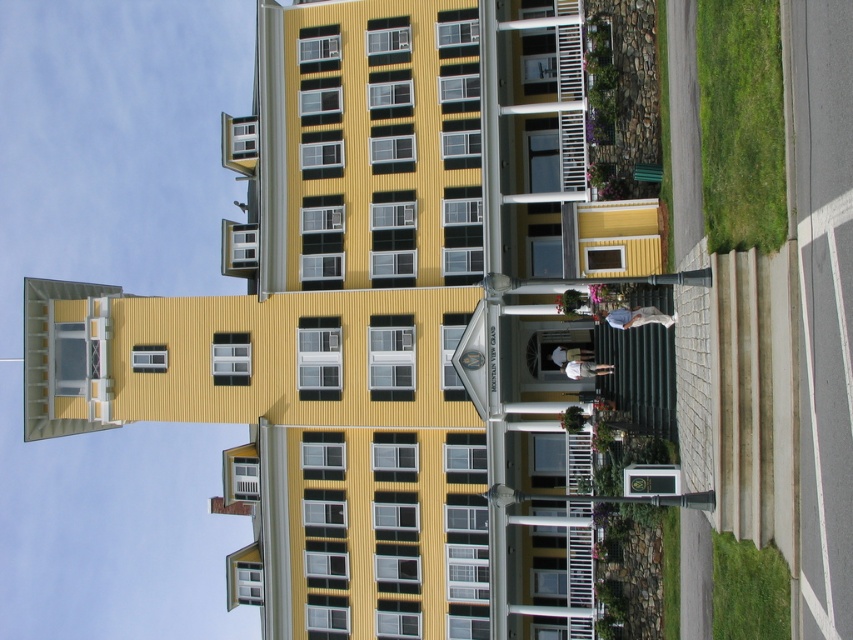
You are standing in front of the MOUNTAIN VIEW GRAND building and notice two points marked on its facade. The first point is at coordinates point (x=769, y=125) and the second is at point (x=770, y=561). Which of these points is closer to your current position?

Point (x=769, y=125) is closer to the camera than point (x=770, y=561), so the first point is closer to your current position.

You are standing in front of the MOUNTAIN VIEW GRAND building and notice two areas of green grass. One is labeled as green grass at right and the other as green grass at lower right. From your vantage point, which grass area is positioned more to the right?

The green grass at right is positioned more to the right compared to the green grass at lower right.